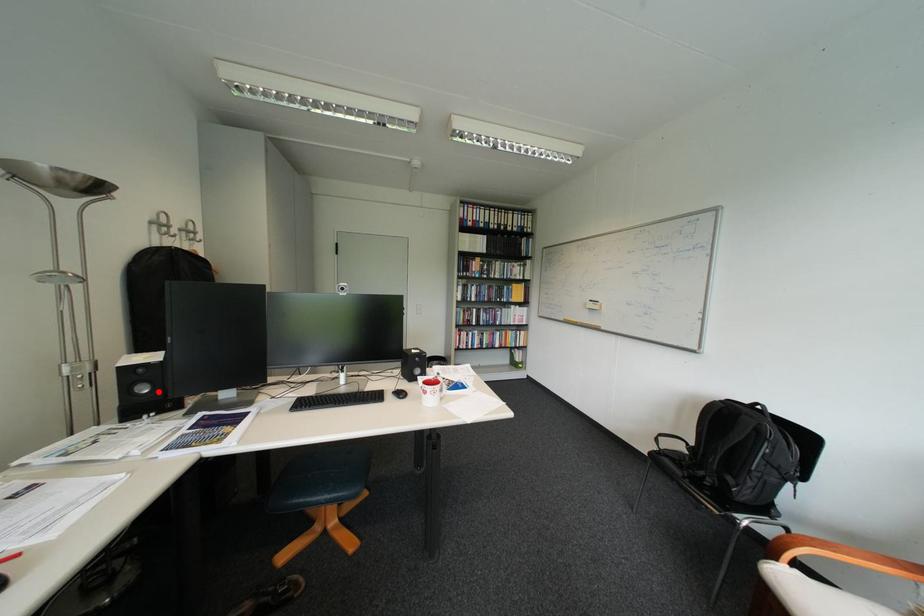
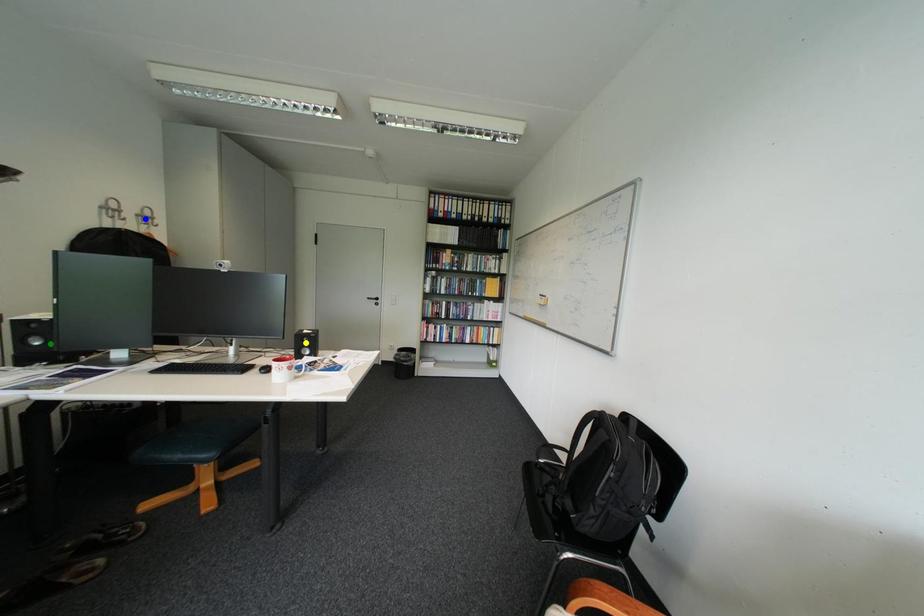
Question: I am providing you with two images of the same scene from different viewpoints. A red point is marked on the first image. You are given multiple points on the second image. Which point in image 2 is actually the same real-world point as the red point in image 1?

Choices:
 (A) blue point
 (B) yellow point
 (C) green point

Answer: (C)